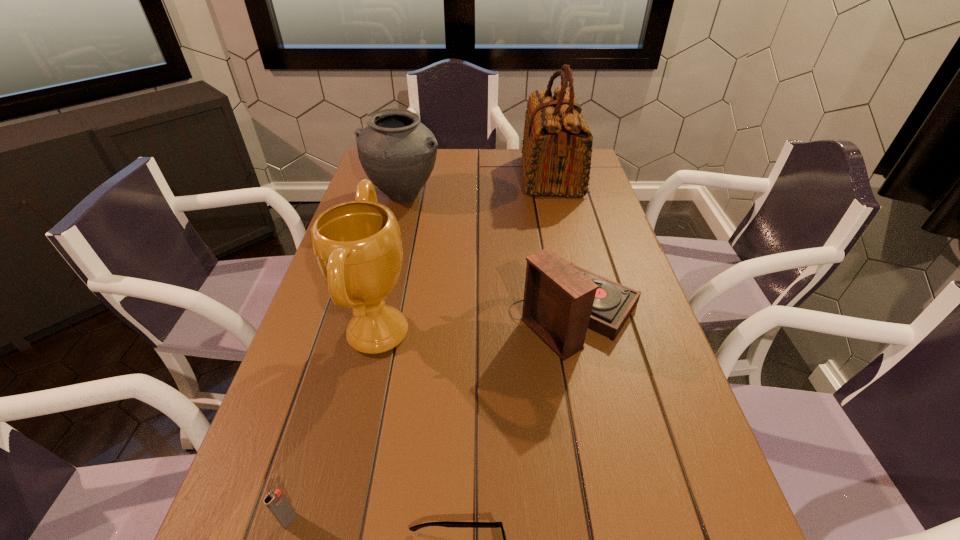
Locate an element on the screen. shopping bag is located at coordinates (557, 147).

I want to click on award, so click(357, 244).

You are a GUI agent. You are given a task and a screenshot of the screen. Output one action in this format:
    pyautogui.click(x=<x>, y=<y>)
    Task: Click on the fourth shortest object
    
    Given the screenshot: What is the action you would take?
    pyautogui.click(x=397, y=152)

Locate an element on the screen. Image resolution: width=960 pixels, height=540 pixels. phonograph record is located at coordinates (561, 301).

Identify the location of the second nearest object. (276, 502).

The image size is (960, 540). I want to click on igniter, so click(x=276, y=502).

At what (x,y) coordinates should I click in order to perform the action: click on vacant space situated on the open handle side of the shopping bag. Please return your answer as a coordinate pair (x, y). The width and height of the screenshot is (960, 540). Looking at the image, I should click on (485, 176).

Identify the location of free region located on the open handle side of the shopping bag. (453, 176).

This screenshot has width=960, height=540. Find the location of `free location located 0.070m on the open handle side of the shopping bag`. free location located 0.070m on the open handle side of the shopping bag is located at coordinates coord(499,176).

The height and width of the screenshot is (540, 960). Find the location of `vacant space located on the front of the award with the decoration`. vacant space located on the front of the award with the decoration is located at coordinates (591, 333).